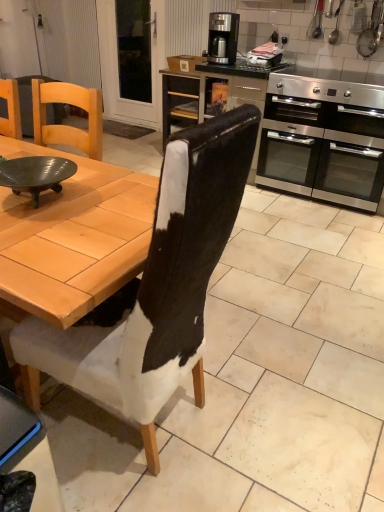
The image size is (384, 512). What are the coordinates of `free point in front of stainless steel oven at right` in the screenshot? It's located at (319, 229).